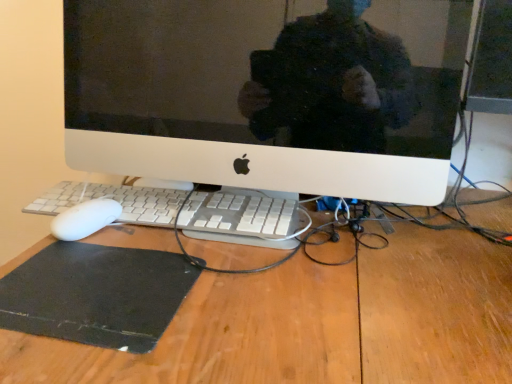
Question: From a real-world perspective, relative to white plastic keyboard at center, is black rubber mousepad at lower left vertically above or below?

Choices:
 (A) above
 (B) below

Answer: (B)

Question: In terms of width, does black rubber mousepad at lower left look wider or thinner when compared to white plastic keyboard at center?

Choices:
 (A) thin
 (B) wide

Answer: (B)

Question: Which is nearer to the wooden desk at center?

Choices:
 (A) white plastic computer monitor at center
 (B) white plastic keyboard at center
 (C) black rubber mousepad at lower left

Answer: (B)

Question: Considering the real-world distances, which object is farthest from the black rubber mousepad at lower left?

Choices:
 (A) white plastic computer monitor at center
 (B) wooden desk at center
 (C) white plastic keyboard at center

Answer: (A)